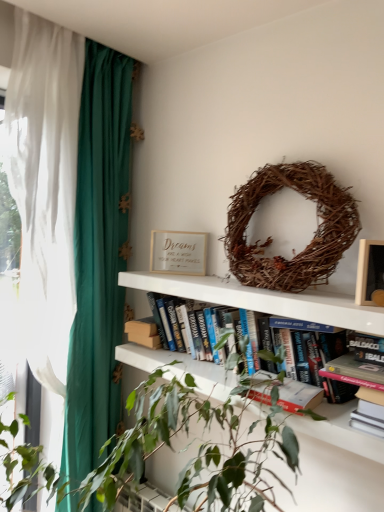
Question: From their relative heights in the image, would you say hardcover books at center is taller or shorter than wooden picture frame at upper right?

Choices:
 (A) tall
 (B) short

Answer: (A)

Question: From a real-world perspective, relative to wooden picture frame at upper right, is hardcover books at center vertically above or below?

Choices:
 (A) below
 (B) above

Answer: (A)

Question: Which of these objects is positioned closest to the brown woven wreath at upper center?

Choices:
 (A) wooden picture frame at upper right
 (B) hardcover books at center
 (C) matte gold frame at upper center
 (D) green leafy plant at center
 (E) green fabric curtain at left

Answer: (A)

Question: Considering the real-world distances, which object is closest to the green fabric curtain at left?

Choices:
 (A) wooden picture frame at upper right
 (B) matte gold frame at upper center
 (C) green leafy plant at center
 (D) brown woven wreath at upper center
 (E) hardcover books at center

Answer: (B)